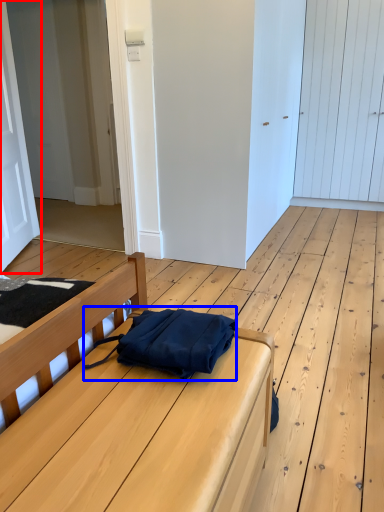
Question: Among these objects, which one is farthest to the camera, door (highlighted by a red box) or messenger bag (highlighted by a blue box)?

Choices:
 (A) door
 (B) messenger bag

Answer: (A)